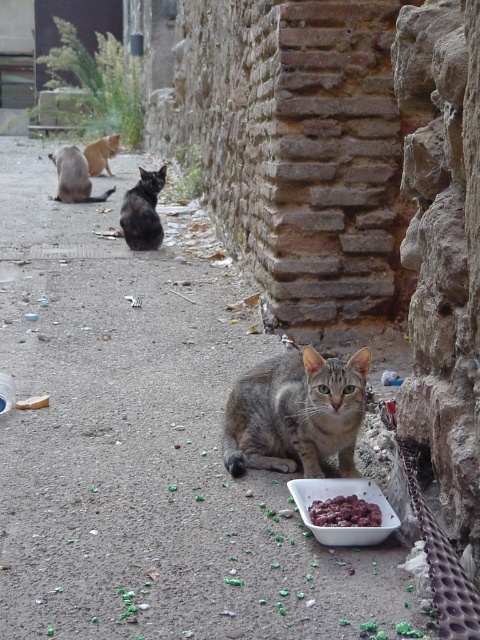
You are a cat owner who wants to feed your cat. You see the white plastic bowl at lower center and the black fur cat at center. Can the cat reach the bowl without moving more than 5 meters?

The distance between the white plastic bowl at lower center and the black fur cat at center is 4.73 meters, so the cat can reach the bowl without moving more than 5 meters.

You are a cat owner who wants to place a new water bowl for your cat. The existing white plastic bowl at lower center is located at coordinate point [344,496]. If you want to place the new water bowl 0.2 units to the right of the existing bowl, what would be the new coordinate point?

The new coordinate point would be 0.775 plus 0.2 in the x direction, so the new coordinate is 0.975, 0.717.